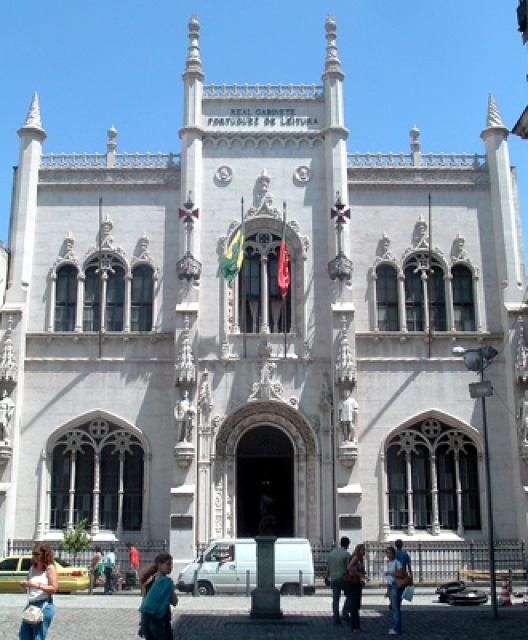
Is point (51, 602) in front of point (129, 550)?

Yes, point (51, 602) is in front of point (129, 550).

Who is more distant from viewer, [36,561] or [128,547]?

The point [128,547] is behind.

You are a GUI agent. You are given a task and a screenshot of the screen. Output one action in this format:
    pyautogui.click(x=<x>, y=<y>)
    Task: Click on the denim jeans at lower left
    
    Given the screenshot: What is the action you would take?
    click(39, 595)

Does denim jeans at lower left have a lesser width compared to teal fabric jacket at lower center?

In fact, denim jeans at lower left might be wider than teal fabric jacket at lower center.

Does denim jeans at lower left have a greater width compared to teal fabric jacket at lower center?

Yes, denim jeans at lower left is wider than teal fabric jacket at lower center.

This screenshot has height=640, width=528. What do you see at coordinates (39, 595) in the screenshot?
I see `denim jeans at lower left` at bounding box center [39, 595].

Locate an element on the screen. The height and width of the screenshot is (640, 528). denim jeans at lower left is located at coordinates (39, 595).

What do you see at coordinates (397, 580) in the screenshot? The image size is (528, 640). I see `denim jeans at lower center` at bounding box center [397, 580].

Between point (400, 630) and point (347, 589), which one is positioned in front?

Point (400, 630) is more forward.

At what (x,y) coordinates should I click in order to perform the action: click on denim jeans at lower center. Please return your answer as a coordinate pair (x, y). This screenshot has height=640, width=528. Looking at the image, I should click on (397, 580).